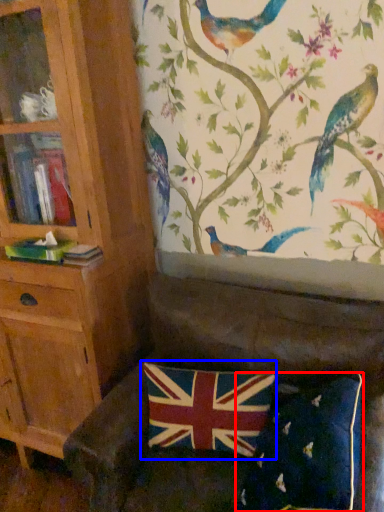
Question: Which object is closer to the camera taking this photo, pillow (highlighted by a red box) or flag (highlighted by a blue box)?

Choices:
 (A) pillow
 (B) flag

Answer: (A)